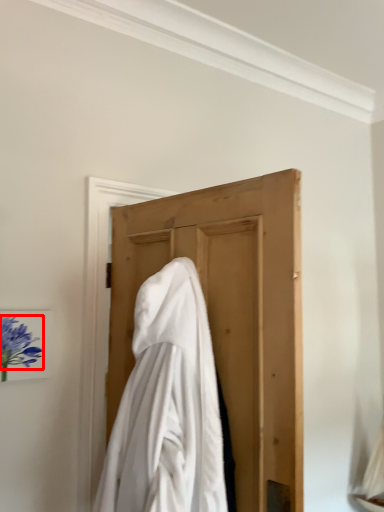
Question: From the image's perspective, considering the relative positions of flower (annotated by the red box) and cloak in the image provided, where is flower (annotated by the red box) located with respect to the staircase?

Choices:
 (A) below
 (B) above

Answer: (B)